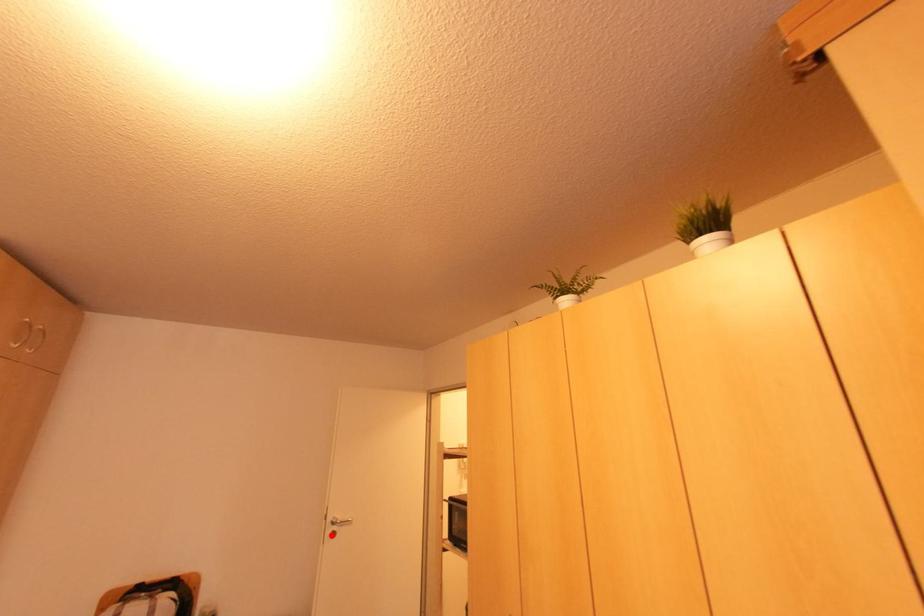
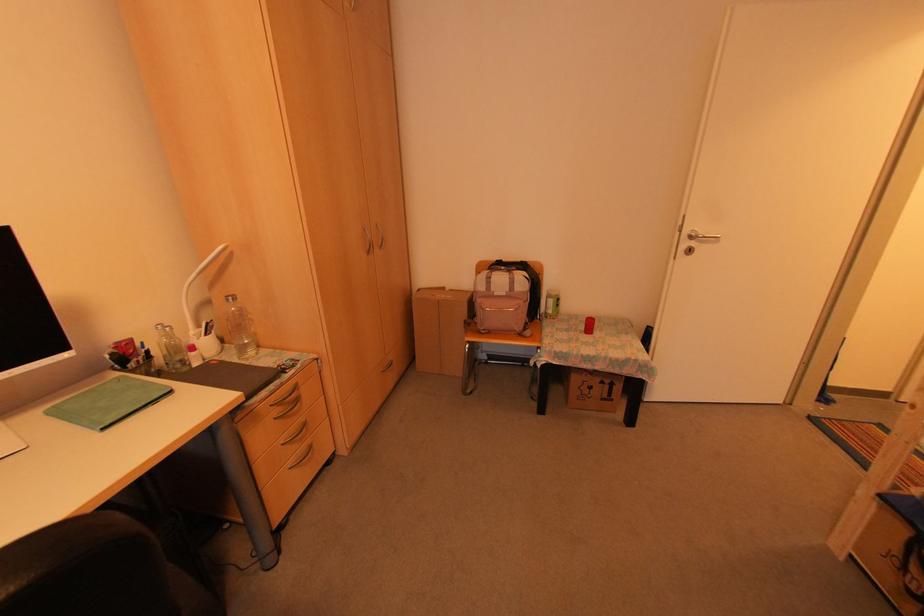
In the second image, find the point that corresponds to the highlighted location in the first image.

(687, 251)